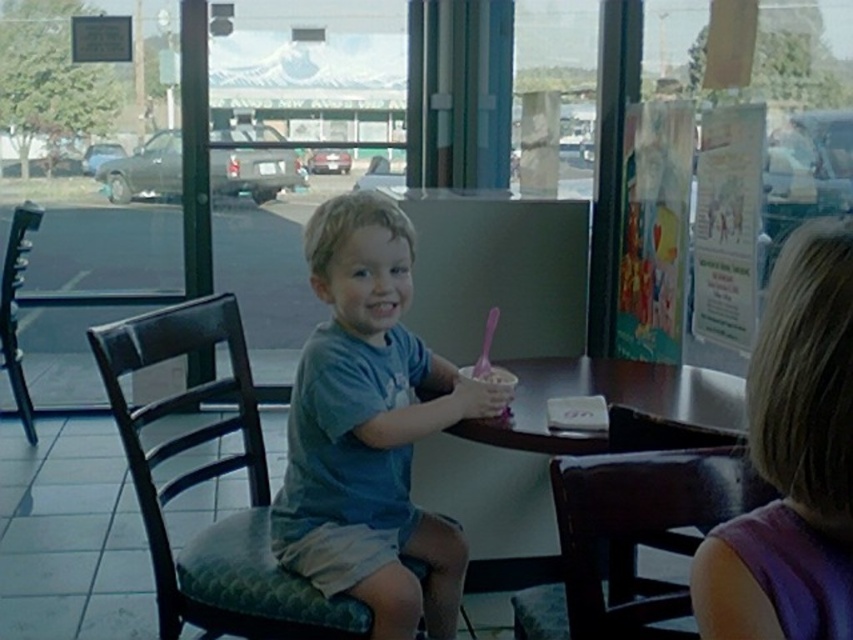
You are a photographer standing in the middle of the dining area. You want to take a photo of the light brown hair at right. What coordinates should you aim your camera at to capture it?

The light brown hair at right is located at coordinates point (792, 460), so you should aim your camera at those coordinates to capture it.

You are a parent looking for your child with light brown hair at right. You see a dark brown leather chair at center. Which direction should you look relative to the chair to find your child?

The light brown hair at right is to the right of the dark brown leather chair at center, so you should look to the right of the dark brown leather chair at center to find your child.